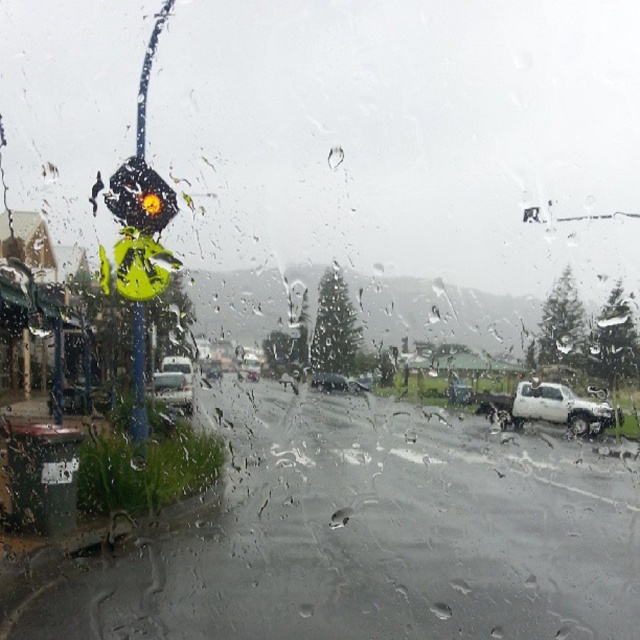
Question: Which of the following is the closest to the observer?

Choices:
 (A) (246, 353)
 (B) (138, 211)
 (C) (314, 372)
 (D) (182, 387)

Answer: (B)

Question: Is silver metallic sedan at center further to camera compared to shiny black sedan at center?

Choices:
 (A) yes
 (B) no

Answer: (B)

Question: Which of the following is the farthest from the observer?

Choices:
 (A) (452, 400)
 (B) (164, 401)
 (C) (344, 388)

Answer: (A)

Question: Considering the real-world distances, which object is closest to the white matte truck at right?

Choices:
 (A) metallic silver sedan at center
 (B) shiny silver sedan at center

Answer: (A)

Question: Can you confirm if white matte truck at right is positioned above metallic silver sedan at center?

Choices:
 (A) yes
 (B) no

Answer: (B)

Question: Can you confirm if white matte truck at right is wider than silver metallic sedan at center?

Choices:
 (A) yes
 (B) no

Answer: (B)